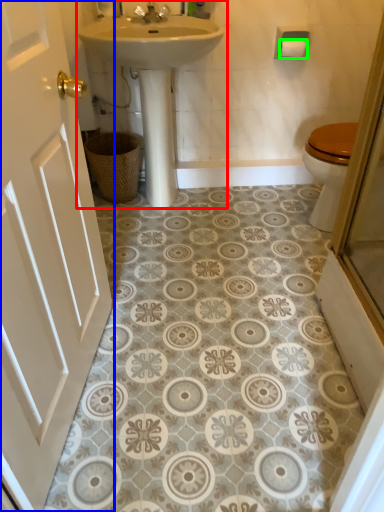
Question: Which is farther away from sink (highlighted by a red box)? door (highlighted by a blue box) or toilet paper (highlighted by a green box)?

Choices:
 (A) door
 (B) toilet paper

Answer: (A)